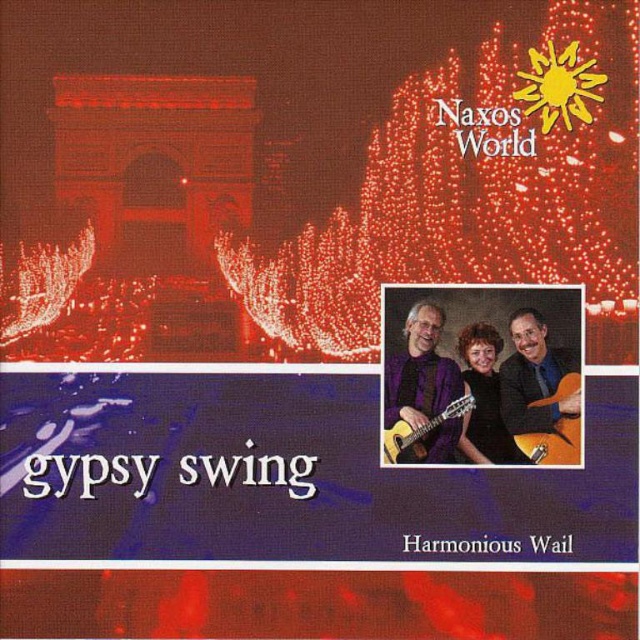
Is black glossy dress at center taller than light brown wooden guitar at center?

Yes, black glossy dress at center is taller than light brown wooden guitar at center.

Does black glossy dress at center have a lesser width compared to light brown wooden guitar at center?

Correct, black glossy dress at center's width is less than light brown wooden guitar at center's.

Is point (490, 442) positioned before point (403, 420)?

No, (490, 442) is further to viewer.

I want to click on black glossy dress at center, so click(483, 397).

Is point (474, 326) positioned behind point (476, 384)?

That is False.

Locate an element on the screen. Image resolution: width=640 pixels, height=640 pixels. purple glossy guitar at center is located at coordinates (483, 372).

Is purple glossy guitar at center positioned in front of matte black guitar at center?

No, purple glossy guitar at center is behind matte black guitar at center.

Does purple glossy guitar at center have a larger size compared to matte black guitar at center?

No.

Which is in front, point (554, 352) or point (541, 426)?

Point (554, 352)

Identify the location of purple glossy guitar at center. Image resolution: width=640 pixels, height=640 pixels. (483, 372).